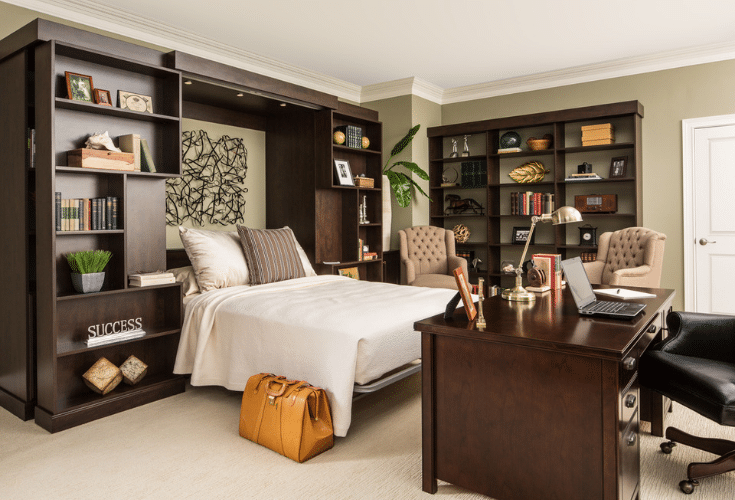
I want to click on dark brown shelves over bed, so click(x=23, y=230), click(x=303, y=191).